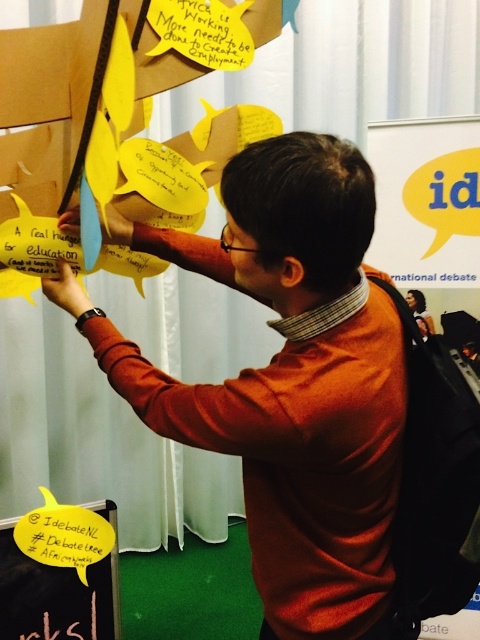
Question: Among these points, which one is nearest to the camera?

Choices:
 (A) (36, 616)
 (B) (81, 301)
 (C) (86, 618)

Answer: (B)

Question: Is yellow paper at upper left to the right of black chalkboard at lower left from the viewer's perspective?

Choices:
 (A) yes
 (B) no

Answer: (A)

Question: Which point is closer to the camera?

Choices:
 (A) black chalkboard at lower left
 (B) yellow paper at upper left

Answer: (B)

Question: Considering the relative positions of yellow paper at upper left and black chalkboard at lower left in the image provided, where is yellow paper at upper left located with respect to black chalkboard at lower left?

Choices:
 (A) left
 (B) right

Answer: (B)

Question: Does orange sweater at center appear on the left side of black chalkboard at lower left?

Choices:
 (A) no
 (B) yes

Answer: (A)

Question: Which of the following is the closest to the observer?

Choices:
 (A) (48, 625)
 (B) (62, 588)

Answer: (B)